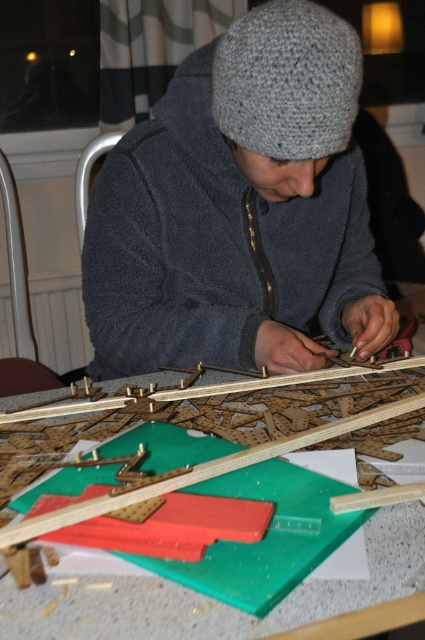
Between gray knitted hat at center and green plastic table at center, which one has less height?

green plastic table at center

Between point (241, 84) and point (323, 456), which one is positioned in front?

Point (323, 456) is more forward.

The height and width of the screenshot is (640, 425). Identify the location of gray knitted hat at center. (288, 81).

From the picture: Does gray knitted hat at upper center appear on the right side of gray knitted hat at center?

Incorrect, gray knitted hat at upper center is not on the right side of gray knitted hat at center.

Between point (340, 205) and point (314, 157), which one is positioned in front?

Point (314, 157) is in front.

Identify the location of gray knitted hat at upper center. The image size is (425, 640). (240, 209).

Where is `gray knitted hat at upper center`? gray knitted hat at upper center is located at coordinates (240, 209).

Between gray knitted hat at upper center and green plastic table at center, which one is positioned lower?

green plastic table at center

Can you confirm if gray knitted hat at upper center is positioned above green plastic table at center?

Yes.

Is point (176, 145) closer to camera compared to point (360, 536)?

No, (176, 145) is further to viewer.

Where is `gray knitted hat at upper center`? gray knitted hat at upper center is located at coordinates 240,209.